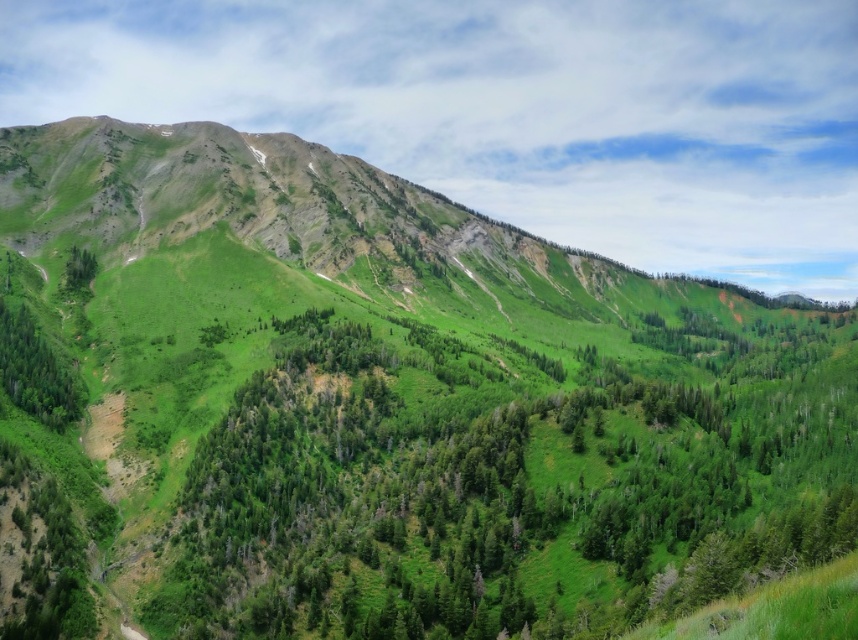
Does green leafy trees at center have a smaller size compared to green leafy tree at upper left?

Incorrect, green leafy trees at center is not smaller in size than green leafy tree at upper left.

Who is more forward, (496, 608) or (88, 250)?

Point (496, 608) is more forward.

Where is `green leafy trees at center`? green leafy trees at center is located at coordinates (503, 493).

Describe the element at coordinates (35, 371) in the screenshot. Image resolution: width=858 pixels, height=640 pixels. I see `green leafy tree at lower left` at that location.

Does green leafy tree at lower left appear on the right side of green leafy tree at upper left?

Yes, green leafy tree at lower left is to the right of green leafy tree at upper left.

Find the location of a particular element. The height and width of the screenshot is (640, 858). green leafy tree at lower left is located at coordinates (35, 371).

Between green leafy trees at center and green leafy tree at lower left, which one is positioned lower?

green leafy trees at center is below.

Which is behind, point (216, 461) or point (49, 353)?

Positioned behind is point (49, 353).

Is point (481, 492) closer to viewer compared to point (11, 369)?

Yes, point (481, 492) is in front of point (11, 369).

Locate an element on the screen. green leafy trees at center is located at coordinates (503, 493).